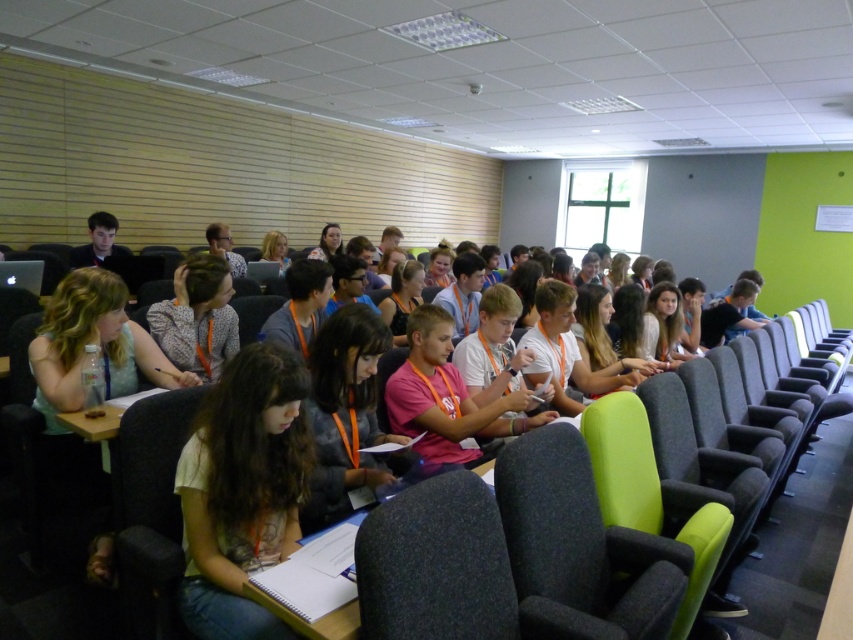
Question: Which object is farther from the camera taking this photo?

Choices:
 (A) dark gray fabric chair at center
 (B) white cotton shirt at center

Answer: (B)

Question: Does white cotton shirt at center have a greater width compared to dark gray fabric chair at center?

Choices:
 (A) yes
 (B) no

Answer: (A)

Question: Among these points, which one is farthest from the camera?

Choices:
 (A) (189, 545)
 (B) (438, 516)

Answer: (A)

Question: Can you confirm if white cotton shirt at center is positioned to the right of dark gray fabric chair at center?

Choices:
 (A) yes
 (B) no

Answer: (B)

Question: Is white cotton shirt at center further to camera compared to dark gray fabric chair at center?

Choices:
 (A) no
 (B) yes

Answer: (B)